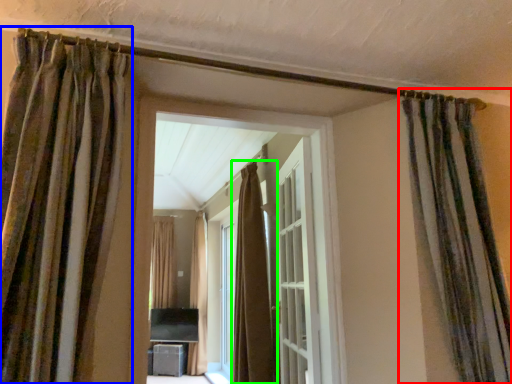
Question: Which object is positioned closest to curtain (highlighted by a red box)? Select from curtain (highlighted by a blue box) and curtain (highlighted by a green box).

Choices:
 (A) curtain
 (B) curtain

Answer: (A)